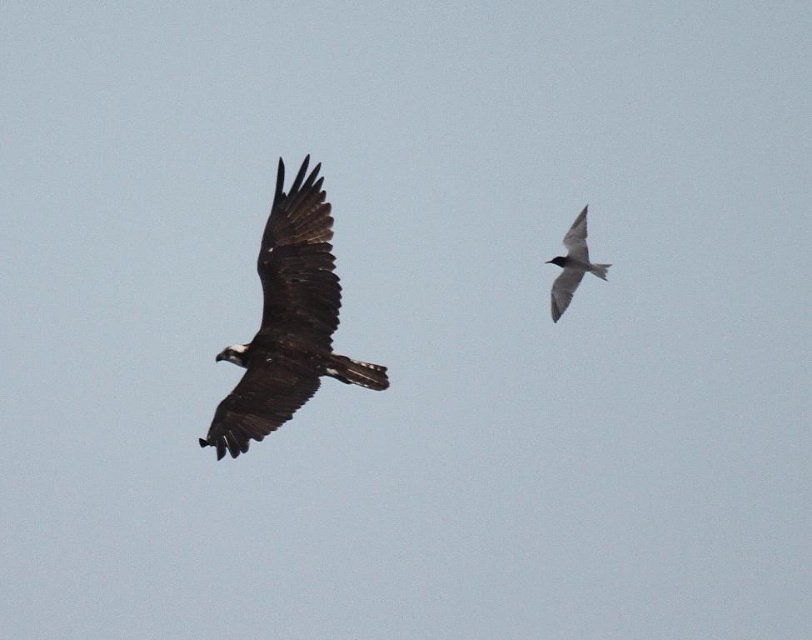
Question: Can you confirm if dark brown feathers at left is wider than gray matte bird at upper right?

Choices:
 (A) no
 (B) yes

Answer: (B)

Question: Can you confirm if dark brown feathers at left is thinner than gray matte bird at upper right?

Choices:
 (A) yes
 (B) no

Answer: (B)

Question: Which object appears farthest from the camera in this image?

Choices:
 (A) dark brown feathers at left
 (B) gray matte bird at upper right

Answer: (B)

Question: Does dark brown feathers at left lie in front of gray matte bird at upper right?

Choices:
 (A) yes
 (B) no

Answer: (A)

Question: Among these objects, which one is nearest to the camera?

Choices:
 (A) dark brown feathers at left
 (B) gray matte bird at upper right

Answer: (A)